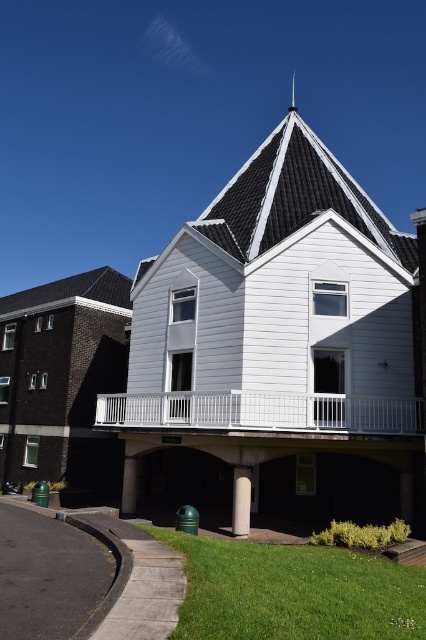
Question: Does white painted wood balcony at center appear on the left side of white smooth pillar at lower center?

Choices:
 (A) yes
 (B) no

Answer: (A)

Question: Among these objects, which one is nearest to the camera?

Choices:
 (A) shiny silver spire at upper center
 (B) white smooth pillar at lower center
 (C) white painted wood balcony at center
 (D) green matte pillar at lower center

Answer: (B)

Question: From the image, what is the correct spatial relationship of green matte pillar at lower center in relation to shiny silver spire at upper center?

Choices:
 (A) below
 (B) above

Answer: (A)

Question: Which is nearer to the white smooth pillar at lower center?

Choices:
 (A) green matte pillar at lower center
 (B) shiny silver spire at upper center
 (C) white painted wood balcony at center

Answer: (C)

Question: Which point is closer to the camera?

Choices:
 (A) shiny silver spire at upper center
 (B) green matte pillar at lower center

Answer: (B)

Question: Can you confirm if white smooth pillar at lower center is bigger than green matte pillar at lower center?

Choices:
 (A) yes
 (B) no

Answer: (B)